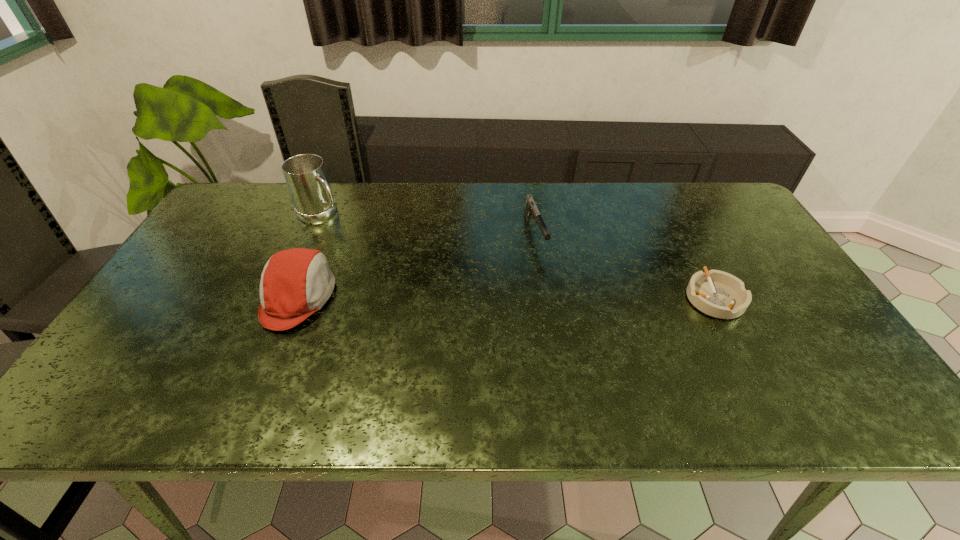
You are a GUI agent. You are given a task and a screenshot of the screen. Output one action in this format:
    pyautogui.click(x=<x>, y=<y>)
    Task: Click on the free space at the near edge
    This screenshot has height=540, width=960.
    Given the screenshot: What is the action you would take?
    pyautogui.click(x=627, y=356)

Locate an element on the screen. Image resolution: width=960 pixels, height=540 pixels. vacant space at the left edge of the desktop is located at coordinates (184, 323).

Locate an element on the screen. Image resolution: width=960 pixels, height=540 pixels. free space at the right edge of the desktop is located at coordinates (722, 226).

Where is `vacant point located between the third shortest object and the ashtray`? vacant point located between the third shortest object and the ashtray is located at coordinates (506, 298).

Locate an element on the screen. The height and width of the screenshot is (540, 960). vacant region between the third object from left to right and the third shortest object is located at coordinates (417, 266).

Find the location of `free spot between the mug and the rightmost object`. free spot between the mug and the rightmost object is located at coordinates (517, 256).

Locate an element on the screen. The height and width of the screenshot is (540, 960). free spot between the third shortest object and the rightmost object is located at coordinates (506, 298).

Identify the location of vacant area between the shortest object and the mug. The height and width of the screenshot is (540, 960). (517, 256).

Where is `free space between the rightmost object and the cap`? This screenshot has height=540, width=960. free space between the rightmost object and the cap is located at coordinates (506, 298).

Image resolution: width=960 pixels, height=540 pixels. I want to click on empty space between the rightmost object and the gun, so click(x=625, y=266).